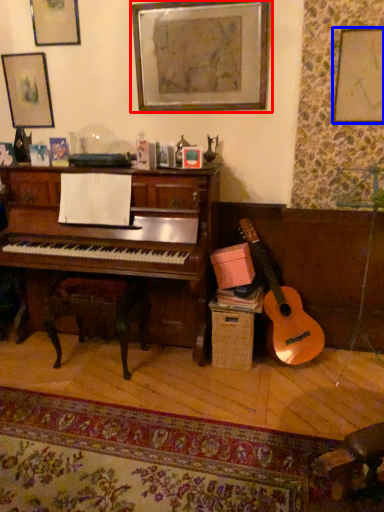
Question: Which object appears closest to the camera in this image, picture frame (highlighted by a red box) or picture frame (highlighted by a blue box)?

Choices:
 (A) picture frame
 (B) picture frame

Answer: (B)